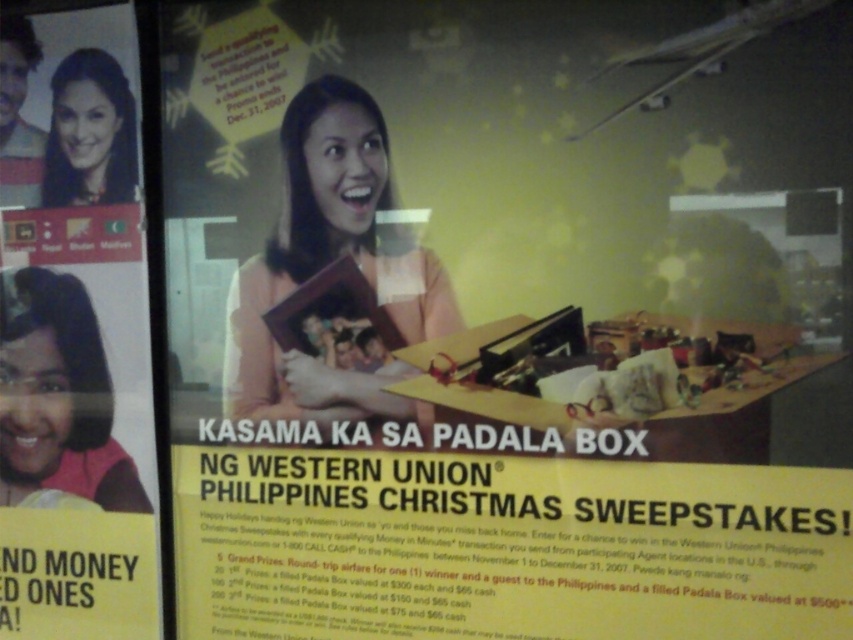
Can you confirm if matte pink shirt at left is wider than matte black hair at upper left?

Yes.

The height and width of the screenshot is (640, 853). Describe the element at coordinates (57, 396) in the screenshot. I see `matte pink shirt at left` at that location.

I want to click on matte pink shirt at left, so click(x=57, y=396).

Is matte orange shirt at center positioned at the back of matte black hair at upper left?

No, it is in front of matte black hair at upper left.

Does point (288, 272) come in front of point (79, 100)?

Yes, it is in front of point (79, 100).

Find the location of `matte orange shirt at center`. matte orange shirt at center is located at coordinates (328, 262).

Does yellow paper advertisement at upper left come in front of matte orange shirt at center?

No.

Does point (26, 172) lie in front of point (332, 385)?

No, (26, 172) is further to viewer.

At what (x,y) coordinates should I click in order to perform the action: click on yellow paper advertisement at upper left. Please return your answer as a coordinate pair (x, y). Looking at the image, I should click on tap(74, 333).